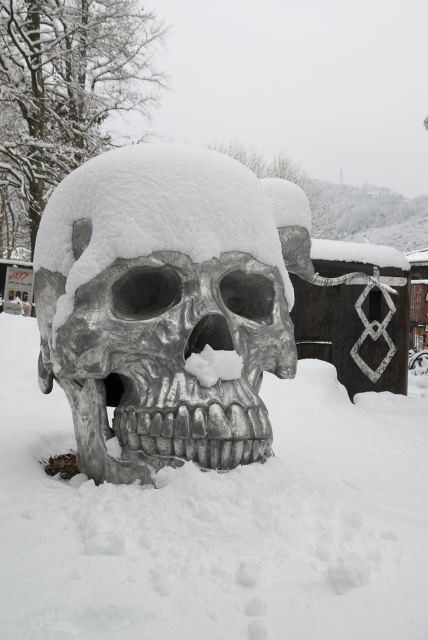
Can you confirm if white frosty skull at center is positioned to the right of slick silver skull at center?

Incorrect, white frosty skull at center is not on the right side of slick silver skull at center.

Who is taller, white frosty skull at center or slick silver skull at center?

slick silver skull at center is taller.

Which is behind, point (163, 612) or point (68, 390)?

The point (68, 390) is behind.

Locate an element on the screen. white frosty skull at center is located at coordinates (219, 522).